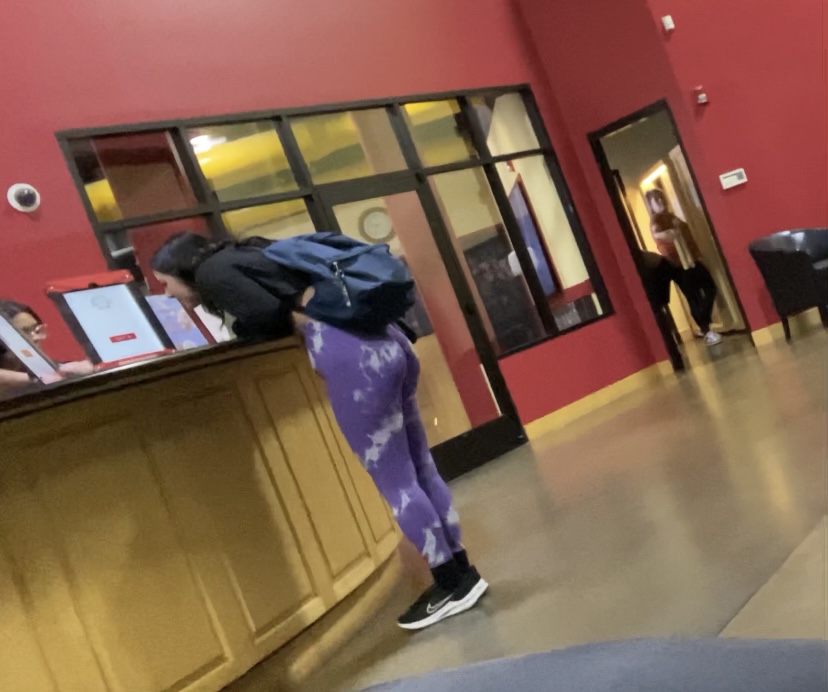
Find the location of a particular element. This screenshot has width=828, height=692. red wall is located at coordinates (764, 149).